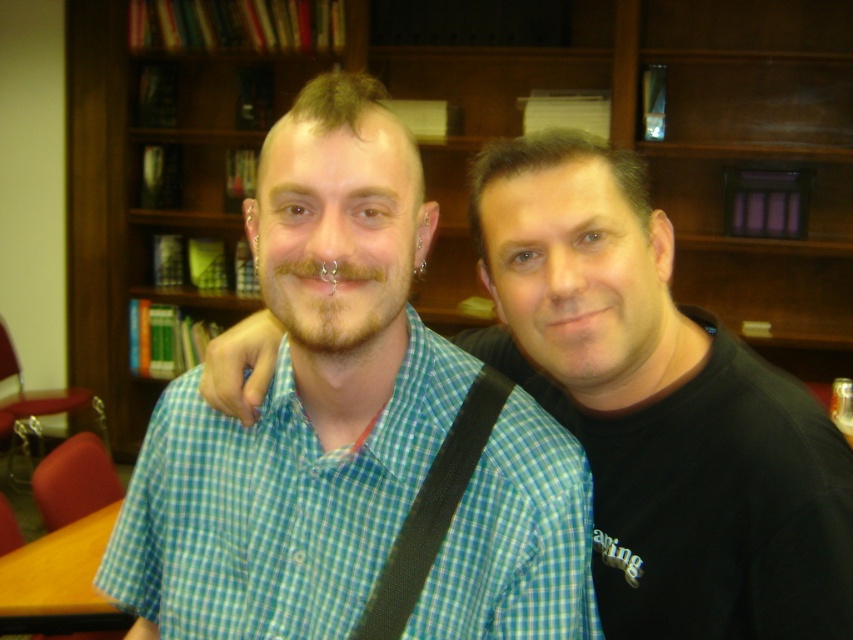
Question: Based on their relative distances, which object is nearer to the green checkered shirt at center?

Choices:
 (A) blue checkered shirt at center
 (B) wooden bookshelf at center
 (C) brownhairbeard at center
 (D) black fabric strap at center

Answer: (D)

Question: Based on their relative distances, which object is nearer to the black fabric strap at center?

Choices:
 (A) brownhairbeard at center
 (B) green checkered shirt at center
 (C) blue checkered shirt at center
 (D) wooden bookshelf at center

Answer: (B)

Question: Considering the relative positions of blue checkered shirt at center and black fabric strap at center in the image provided, where is blue checkered shirt at center located with respect to black fabric strap at center?

Choices:
 (A) above
 (B) below

Answer: (A)

Question: Is wooden bookshelf at center to the right of black fabric strap at center from the viewer's perspective?

Choices:
 (A) no
 (B) yes

Answer: (A)

Question: Is wooden bookshelf at center further to the viewer compared to green checkered shirt at center?

Choices:
 (A) yes
 (B) no

Answer: (A)

Question: Which object appears farthest from the camera in this image?

Choices:
 (A) brownhairbeard at center
 (B) black fabric strap at center
 (C) wooden bookshelf at center
 (D) blue checkered shirt at center

Answer: (C)